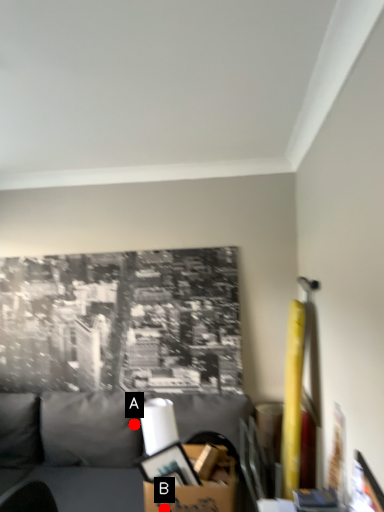
Question: Two points are circled on the image, labeled by A and B beside each circle. Which of the following is the farthest from the observer?

Choices:
 (A) A is further
 (B) B is further

Answer: (A)